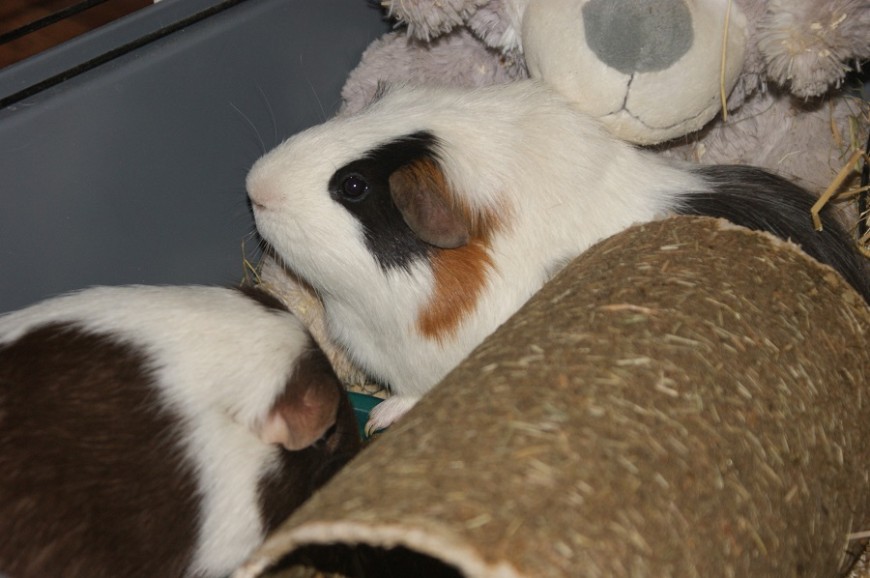
Identify the location of teddy bear nose. The image size is (870, 578). (658, 42).